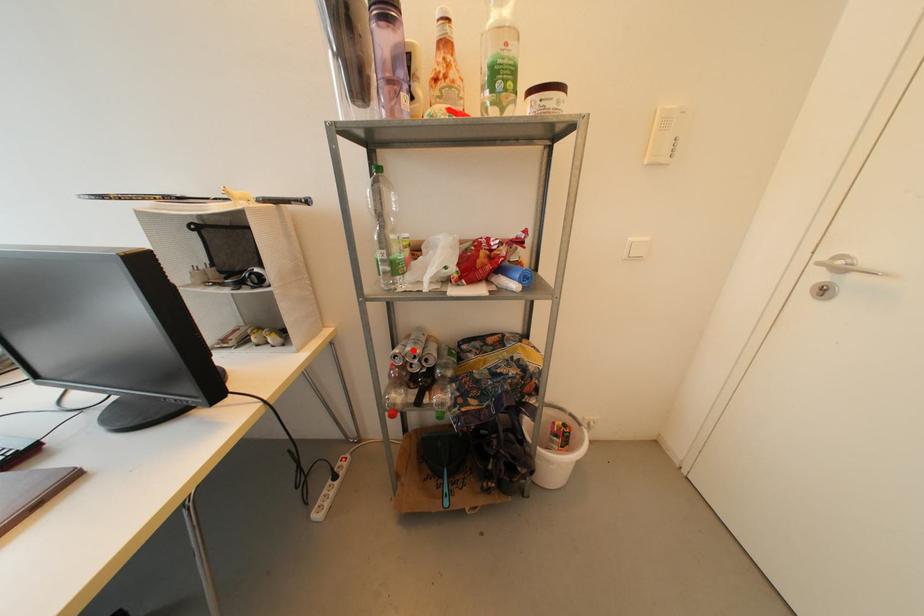
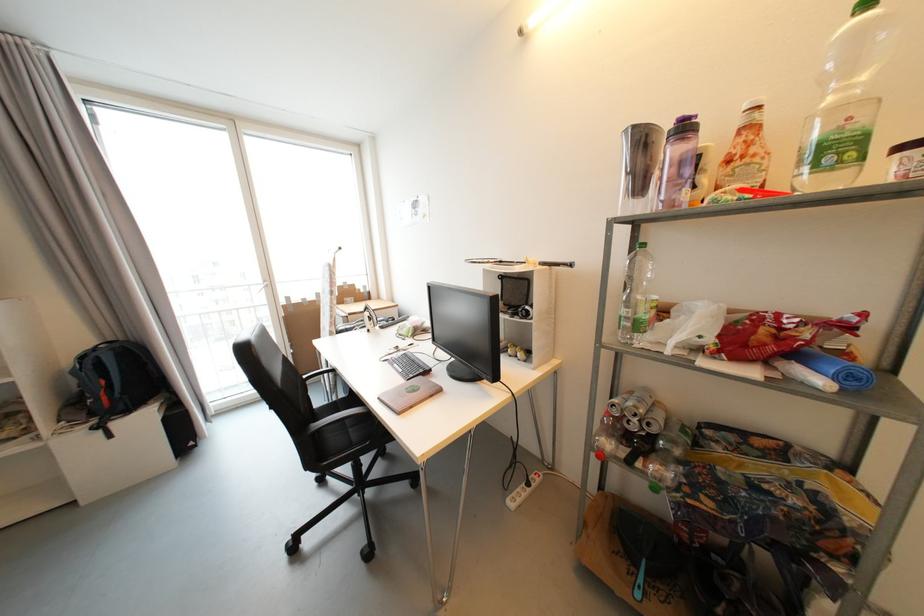
Find the pixel in the second image that matches the highlighted location in the first image.

(635, 406)